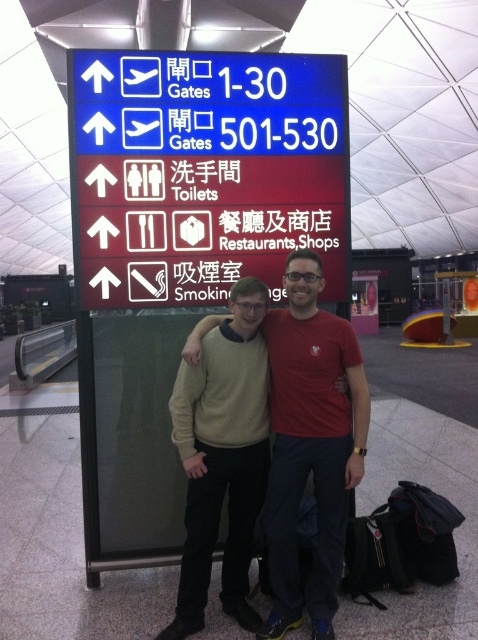
You are standing in front of the airport terminal signboard. You see a point at coordinates (205, 172). What is located at that point?

The point at coordinates (205, 172) indicates a blue plastic sign at upper center.